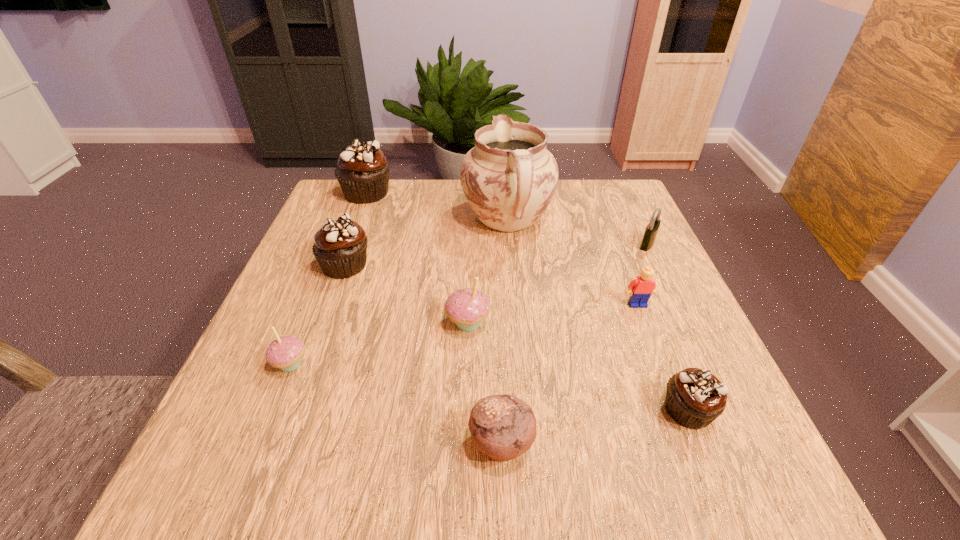
Locate an element on the screen. This screenshot has width=960, height=540. the second nearest cupcake is located at coordinates (285, 352).

Locate an element on the screen. The height and width of the screenshot is (540, 960). the nearer pink cupcake is located at coordinates (285, 352).

Find the location of a particular element. Image resolution: width=960 pixels, height=540 pixels. the rightmost brown cupcake is located at coordinates (695, 398).

Identify the location of the nearest cupcake. (695, 398).

Locate an element on the screen. The width and height of the screenshot is (960, 540). muffin is located at coordinates (503, 427).

The width and height of the screenshot is (960, 540). What are the coordinates of `vacant space located on the right of the farthest brown cupcake` in the screenshot? It's located at (425, 193).

Find the location of a particular element. This screenshot has height=540, width=960. free space located 0.240m on the right of the second nearest brown cupcake is located at coordinates (479, 266).

The image size is (960, 540). I want to click on vacant space located on the right of the bigger pink cupcake, so coord(636,323).

Image resolution: width=960 pixels, height=540 pixels. In order to click on free spot located 0.060m on the front of the padlock in this screenshot , I will do `click(659, 268)`.

This screenshot has height=540, width=960. I want to click on free space located on the face of the Lego, so click(656, 352).